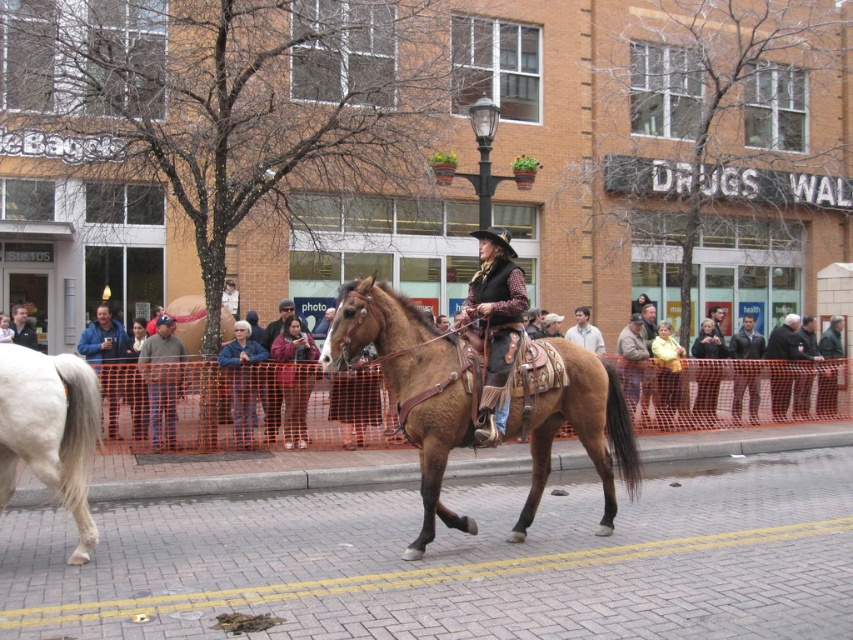
Is brown leather horse at center smaller than leather vest at center?

No.

What do you see at coordinates (410, 385) in the screenshot? I see `brown leather horse at center` at bounding box center [410, 385].

The height and width of the screenshot is (640, 853). I want to click on brown leather horse at center, so click(x=410, y=385).

Is leather jacket at center in front of blue denim jacket at center?

No, it is behind blue denim jacket at center.

Is point (312, 362) positioned after point (248, 435)?

Yes.

At what (x,y) coordinates should I click in order to perform the action: click on leather jacket at center. Please return your answer as a coordinate pair (x, y). Looking at the image, I should click on (294, 378).

Does leather vest at center have a greater width compared to blue denim jacket at center?

Incorrect, leather vest at center's width does not surpass blue denim jacket at center's.

Locate an element on the screen. leather vest at center is located at coordinates (495, 324).

Is point (485, 253) positioned in front of point (258, 362)?

Yes, point (485, 253) is closer to viewer.

This screenshot has width=853, height=640. Find the location of `leather vest at center`. leather vest at center is located at coordinates (495, 324).